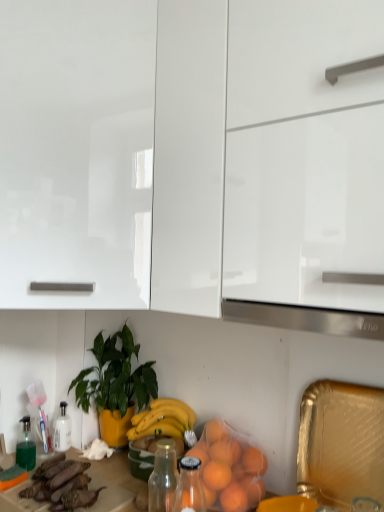
Find the location of `unoccupied area in front of green translucent bottle at lower left`. unoccupied area in front of green translucent bottle at lower left is located at coordinates (16, 492).